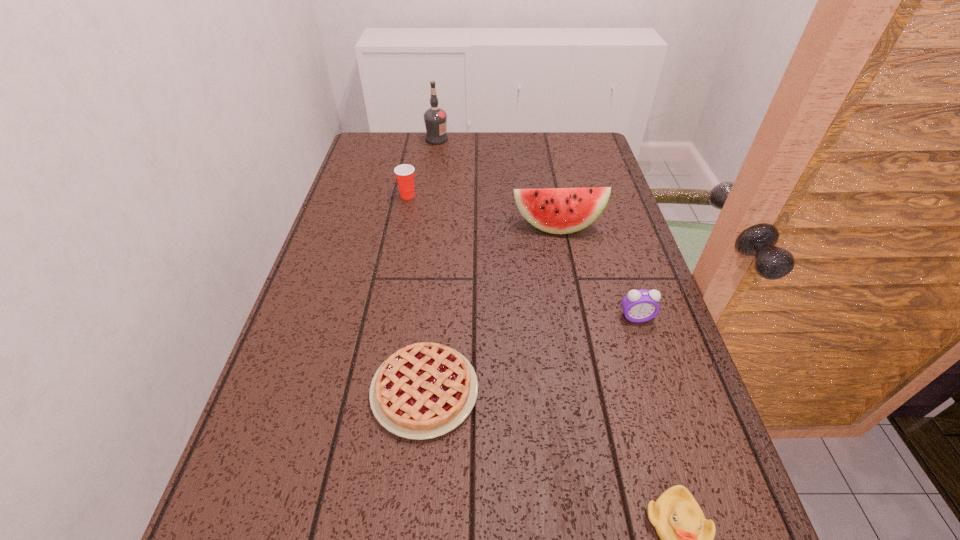
The width and height of the screenshot is (960, 540). In order to click on vacant space located 0.100m on the back of the second farthest object in this screenshot , I will do `click(413, 173)`.

The image size is (960, 540). Identify the location of vacant space located on the face of the fourth farthest object. (685, 470).

Identify the location of free space located on the left of the fifth farthest object. (288, 390).

Where is `object present at the far edge`? This screenshot has width=960, height=540. object present at the far edge is located at coordinates (435, 118).

Find the location of a particular element. This screenshot has width=960, height=540. watermelon that is positioned at the right edge is located at coordinates (554, 210).

At what (x,y) coordinates should I click in order to perform the action: click on alarm clock that is at the right edge. Please return your answer as a coordinate pair (x, y). This screenshot has height=540, width=960. Looking at the image, I should click on (639, 306).

The height and width of the screenshot is (540, 960). Find the location of `free spot at the far edge of the desktop`. free spot at the far edge of the desktop is located at coordinates (445, 145).

Find the location of a particular element. vacant space at the left edge of the desktop is located at coordinates (329, 421).

The image size is (960, 540). What are the coordinates of `free space at the right edge` in the screenshot? It's located at (606, 187).

Where is `free space at the far left corner of the desktop`? This screenshot has height=540, width=960. free space at the far left corner of the desktop is located at coordinates (381, 133).